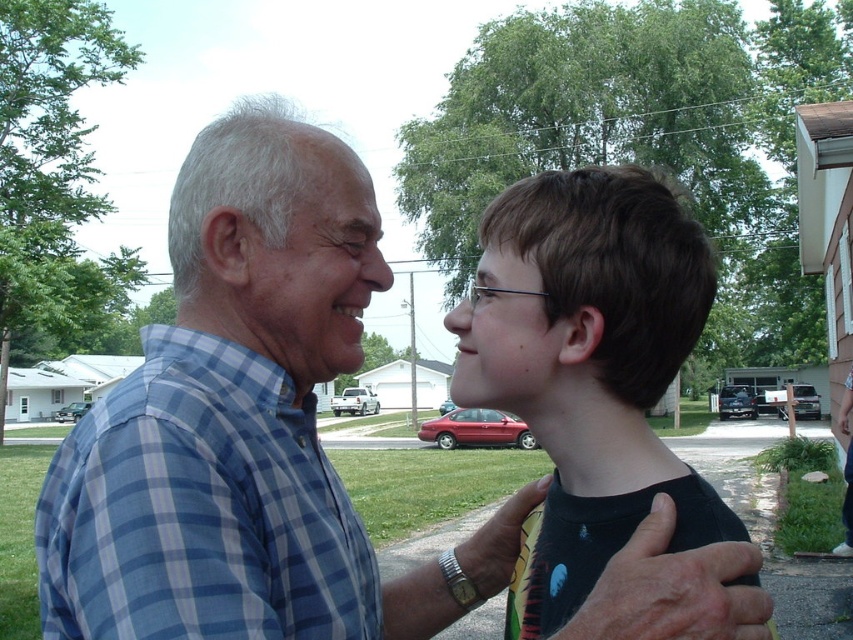
Question: Which object appears farthest from the camera in this image?

Choices:
 (A) blue plaid shirt at center
 (B) blue plaid shirt at left

Answer: (B)

Question: Does blue plaid shirt at left come in front of black matte shirt at center?

Choices:
 (A) no
 (B) yes

Answer: (B)

Question: Among these objects, which one is nearest to the camera?

Choices:
 (A) blue plaid shirt at left
 (B) blue plaid shirt at center
 (C) black matte shirt at center

Answer: (B)

Question: Estimate the real-world distances between objects in this image. Which object is closer to the blue plaid shirt at left?

Choices:
 (A) black matte shirt at center
 (B) blue plaid shirt at center

Answer: (B)

Question: Does blue plaid shirt at left appear on the right side of black matte shirt at center?

Choices:
 (A) no
 (B) yes

Answer: (A)

Question: Observing the image, what is the correct spatial positioning of blue plaid shirt at center in reference to blue plaid shirt at left?

Choices:
 (A) above
 (B) below

Answer: (A)